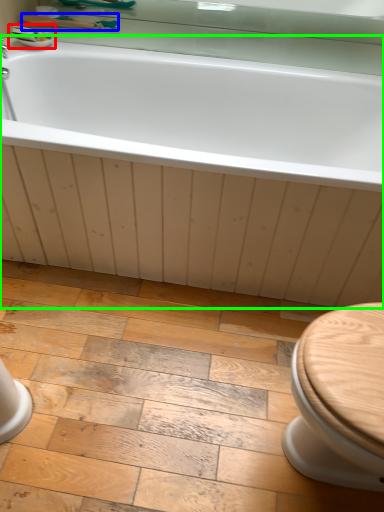
Question: Estimate the real-world distances between objects in this image. Which object is closer to sink (highlighted by a red box), shower (highlighted by a blue box) or bathtub (highlighted by a green box)?

Choices:
 (A) shower
 (B) bathtub

Answer: (A)